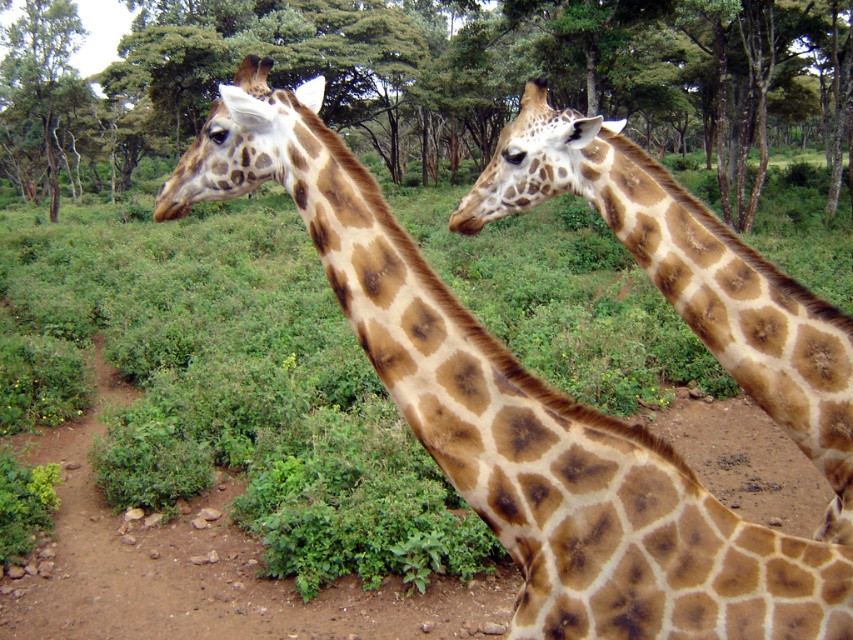
Question: Which of these objects is positioned closest to the spotted brown giraffe at center?

Choices:
 (A) brown dirt track at center
 (B) green leafy tree at center

Answer: (A)

Question: Is spotted brown giraffe at center below brown dirt track at center?

Choices:
 (A) no
 (B) yes

Answer: (A)

Question: Can you confirm if green leafy tree at center is thinner than spotted brown giraffe at center?

Choices:
 (A) yes
 (B) no

Answer: (B)

Question: Among these points, which one is nearest to the camera?

Choices:
 (A) click(x=12, y=44)
 (B) click(x=758, y=296)
 (C) click(x=379, y=624)

Answer: (B)

Question: Which of the following is the farthest from the observer?

Choices:
 (A) brown dirt track at center
 (B) green leafy tree at center

Answer: (B)

Question: Where is spotted brown giraffe at center located in relation to brown dirt track at center in the image?

Choices:
 (A) left
 (B) right

Answer: (B)